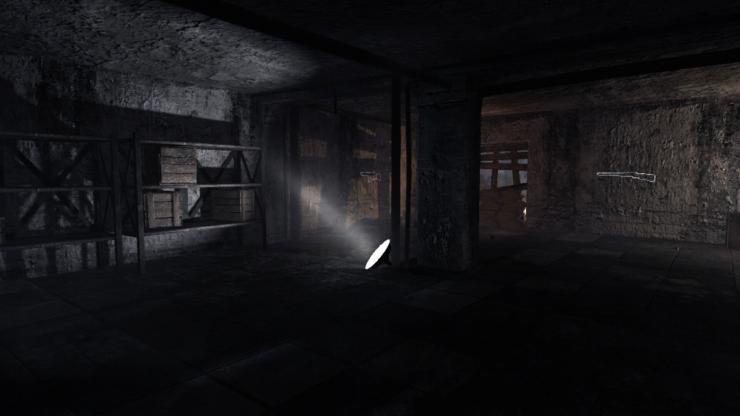
Locate an element on the screen. This screenshot has height=416, width=740. shelf is located at coordinates 141,188.